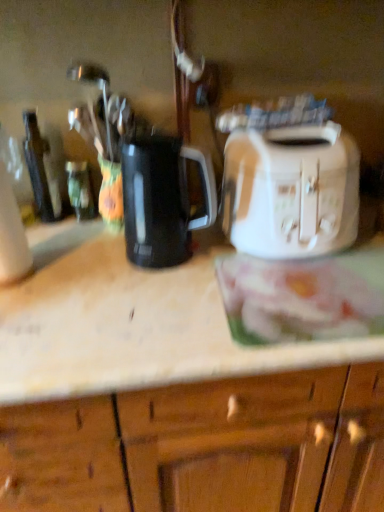
At what (x,y) coordinates should I click in order to perform the action: click on vacant space in front of green glass bottle at left, which is counted as the 2th bottle, starting from the left. Please return your answer as a coordinate pair (x, y). This screenshot has width=384, height=512. Looking at the image, I should click on (73, 246).